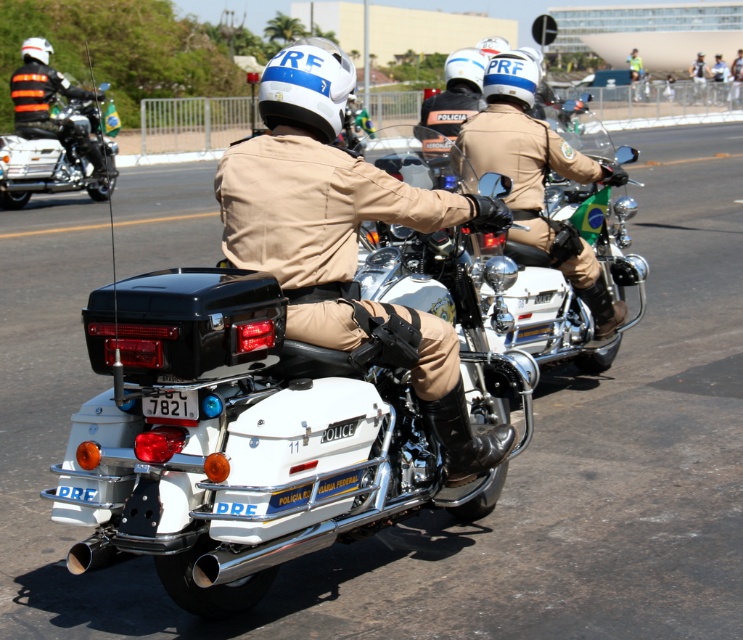
Is white metallic motorcycle at center behind matte black motorcycle at left?

No.

Is white metallic motorcycle at center closer to the viewer compared to matte black motorcycle at left?

Yes, white metallic motorcycle at center is closer to the viewer.

This screenshot has width=743, height=640. I want to click on white metallic motorcycle at center, so click(282, 416).

Which is more to the right, matte black helmet at upper center or matte black motorcycle at left?

From the viewer's perspective, matte black helmet at upper center appears more on the right side.

Is matte black helmet at upper center above matte black motorcycle at left?

No, matte black helmet at upper center is not above matte black motorcycle at left.

Is point (522, 134) in front of point (110, 189)?

Yes, point (522, 134) is closer to viewer.

At what (x,y) coordinates should I click in order to perform the action: click on matte black helmet at upper center. Please return your answer as a coordinate pair (x, y). This screenshot has width=743, height=640. Looking at the image, I should click on (536, 177).

Is white metallic motorcycle at center above matte black helmet at upper center?

Actually, white metallic motorcycle at center is below matte black helmet at upper center.

Locate an element on the screen. The width and height of the screenshot is (743, 640). white metallic motorcycle at center is located at coordinates (282, 416).